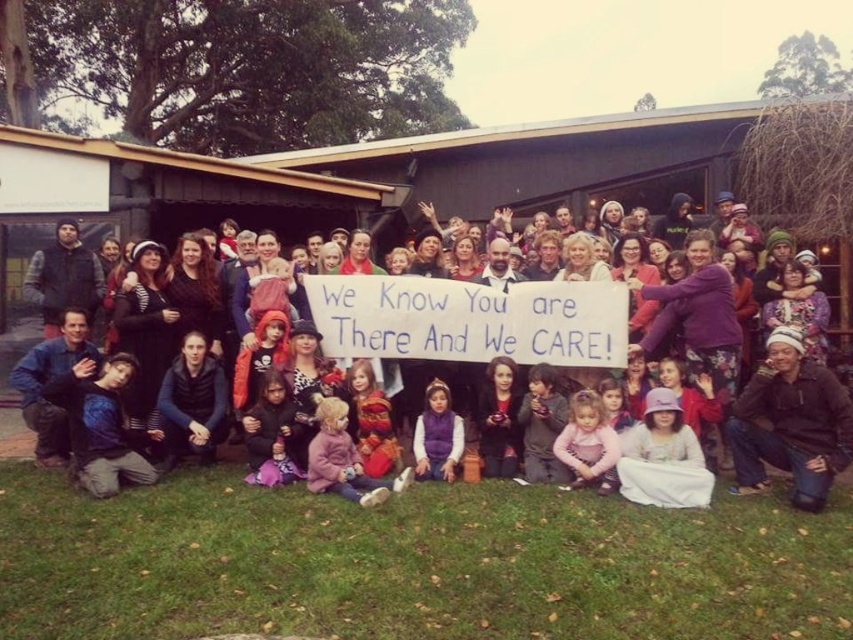
Looking at this image, who is lower down, purple fleece vest at center or matte black jacket at center?

matte black jacket at center is lower down.

Does purple fleece vest at center have a greater height compared to matte black jacket at center?

Correct, purple fleece vest at center is much taller as matte black jacket at center.

Identify the location of purple fleece vest at center. The image size is (853, 640). (437, 435).